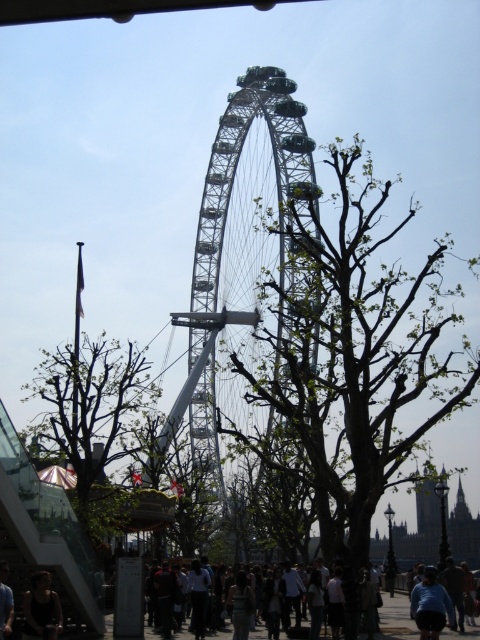
Question: Is green leafy tree at left bigger than blue denim jeans at lower right?

Choices:
 (A) yes
 (B) no

Answer: (A)

Question: Estimate the real-world distances between objects in this image. Which object is closer to the green metallic ferris wheel at center?

Choices:
 (A) dark gray shirt at center
 (B) green leafy tree at center
 (C) blue denim jeans at lower right

Answer: (B)

Question: Does green leafy tree at left come in front of blue t-shirt at center?

Choices:
 (A) yes
 (B) no

Answer: (B)

Question: Which of the following is the closest to the observer?

Choices:
 (A) green metallic ferris wheel at center
 (B) green leafy tree at center
 (C) blue t-shirt at center

Answer: (B)

Question: Does green leafy tree at center appear on the left side of dark gray shirt at center?

Choices:
 (A) no
 (B) yes

Answer: (A)

Question: Which object is the farthest from the green metallic ferris wheel at center?

Choices:
 (A) green leafy tree at left
 (B) dark brown hair at lower left
 (C) green leafy tree at center
 (D) blue denim jeans at lower right

Answer: (D)